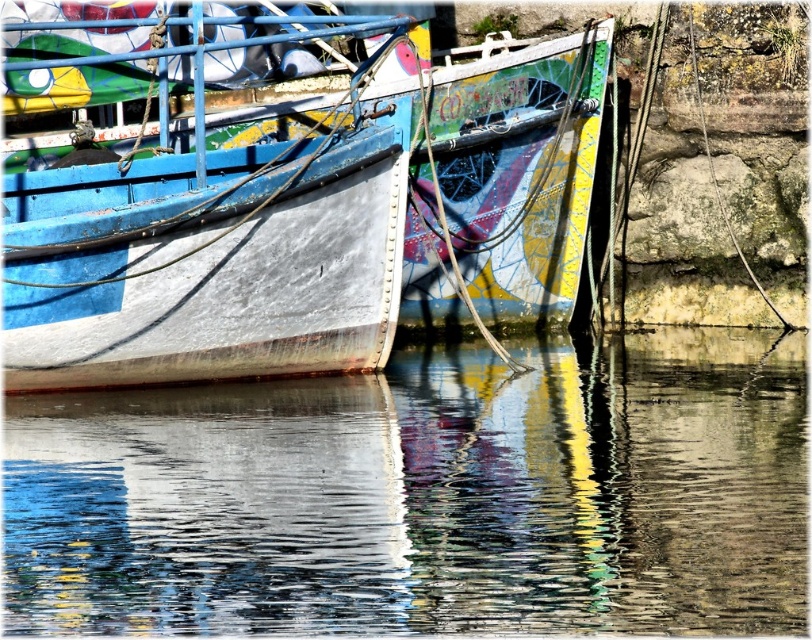
Question: Among these points, which one is farthest from the camera?

Choices:
 (A) click(140, 161)
 (B) click(396, 380)

Answer: (A)

Question: Where is glossy water at lower center located in relation to rusty metal boat at left in the image?

Choices:
 (A) above
 (B) below

Answer: (B)

Question: Does glossy water at lower center have a greater width compared to rusty metal boat at left?

Choices:
 (A) yes
 (B) no

Answer: (B)

Question: Which point appears farthest from the camera in this image?

Choices:
 (A) (426, 484)
 (B) (204, 285)

Answer: (B)

Question: Considering the relative positions of glossy water at lower center and rusty metal boat at left in the image provided, where is glossy water at lower center located with respect to rusty metal boat at left?

Choices:
 (A) below
 (B) above

Answer: (A)